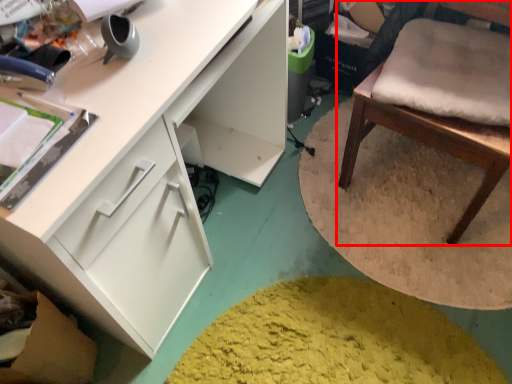
Question: From the image's perspective, where is chair (annotated by the red box) located in relation to cabinetry in the image?

Choices:
 (A) above
 (B) below

Answer: (A)